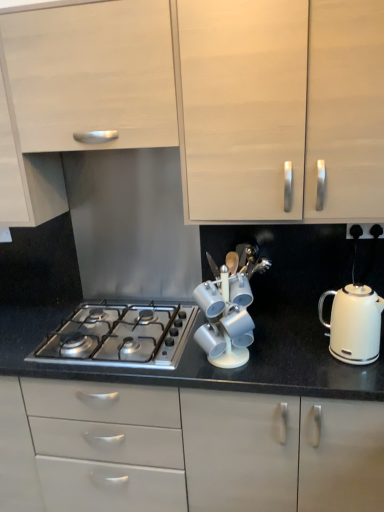
Where is `free space above white matte cabinet at center, the 1th cabinetry in the bottom-to-top sequence (from a real-world perspective)`? Image resolution: width=384 pixels, height=512 pixels. free space above white matte cabinet at center, the 1th cabinetry in the bottom-to-top sequence (from a real-world perspective) is located at coordinates (194, 346).